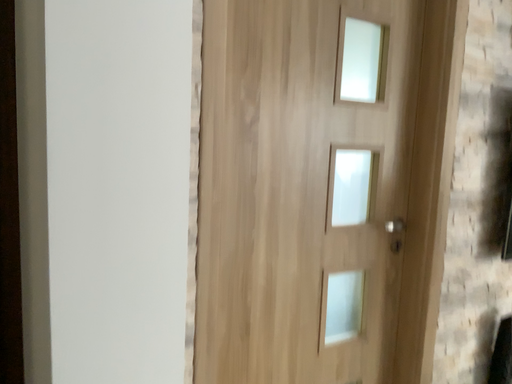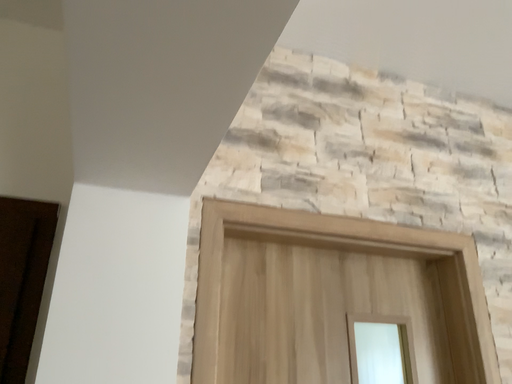
Question: Which way did the camera rotate in the video?

Choices:
 (A) rotated left
 (B) rotated right

Answer: (A)